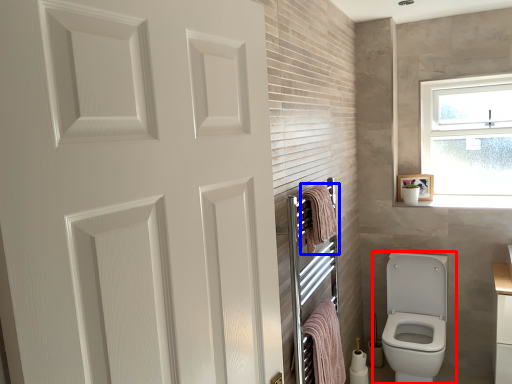
Question: Among these objects, which one is farthest to the camera, toilet (highlighted by a red box) or bath towel (highlighted by a blue box)?

Choices:
 (A) toilet
 (B) bath towel

Answer: (A)